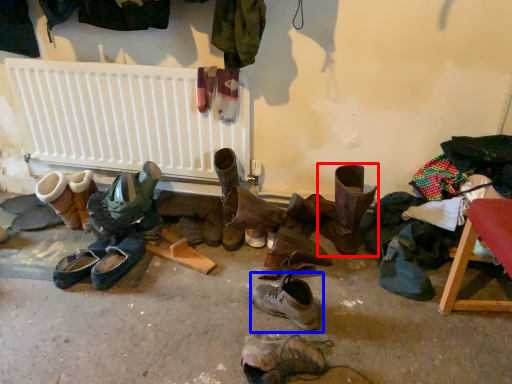
Question: Which of the following is the farthest to the observer, footwear (highlighted by a red box) or footwear (highlighted by a blue box)?

Choices:
 (A) footwear
 (B) footwear

Answer: (A)